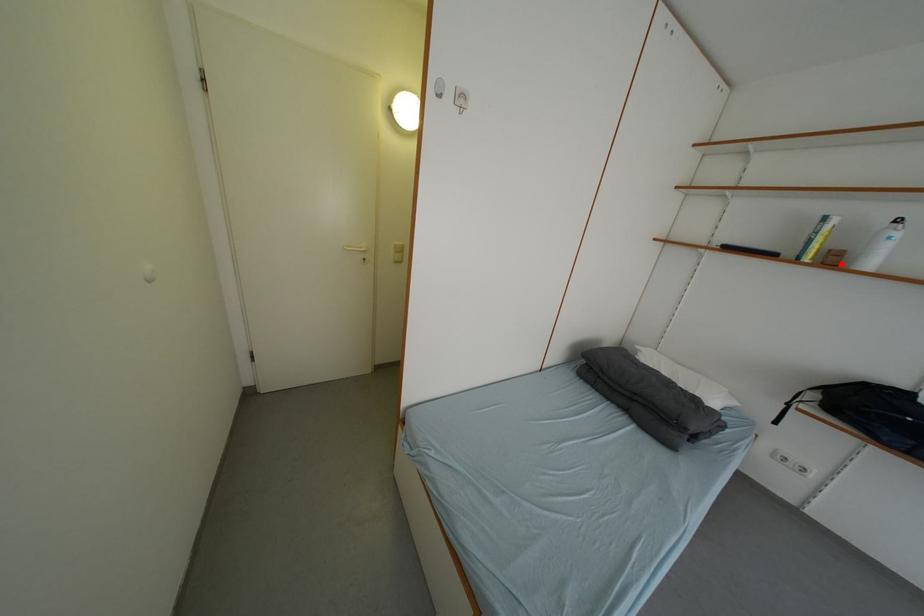
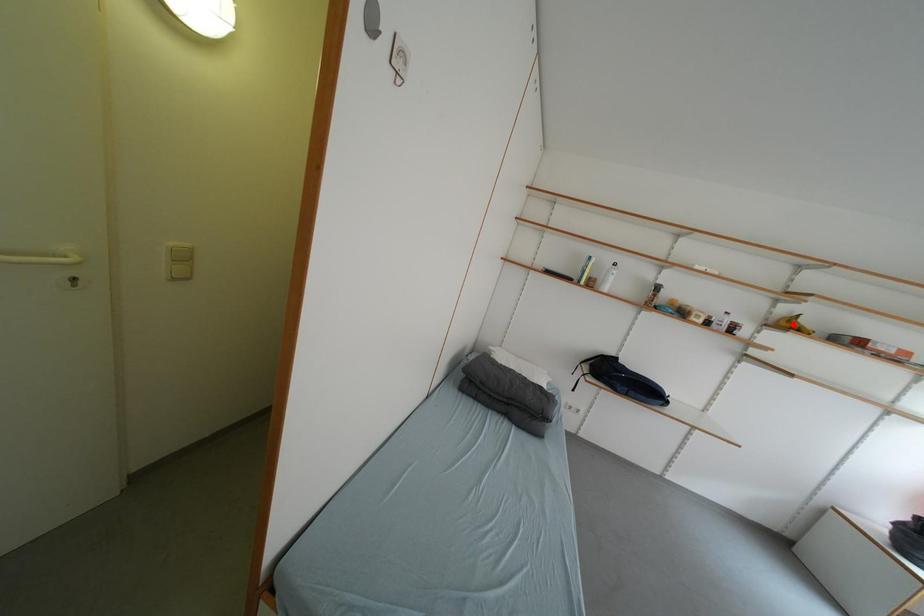
Consider the image. I am providing you with two images of the same scene from different viewpoints. A red point is marked on the first image and another point is marked on the second image. Is the marked point in image1 the same physical position as the marked point in image2?

No